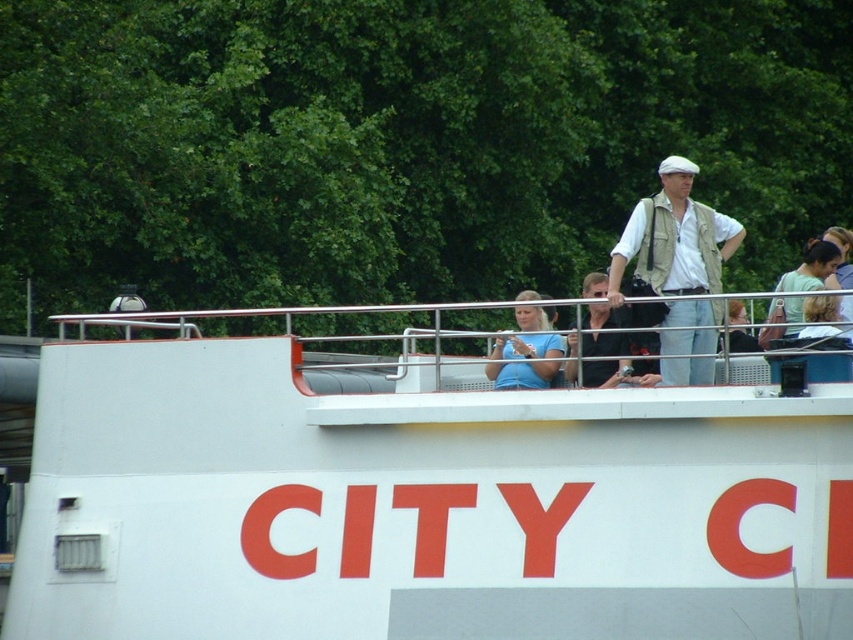
Question: Considering the real-world distances, which object is farthest from the matte blue shirt at center?

Choices:
 (A) light brown leather jacket at upper right
 (B) light beige vest at center
 (C) white matte boat at center

Answer: (C)

Question: Observing the image, what is the correct spatial positioning of white matte boat at center in reference to light brown leather jacket at upper right?

Choices:
 (A) below
 (B) above

Answer: (A)

Question: Estimate the real-world distances between objects in this image. Which object is closer to the light beige vest at center?

Choices:
 (A) light brown wooden chair at upper center
 (B) light brown leather jacket at upper right
 (C) matte blue shirt at center

Answer: (A)

Question: Which point is closer to the camera?

Choices:
 (A) light brown wooden chair at upper center
 (B) light brown leather jacket at upper right
 (C) matte blue shirt at center

Answer: (B)

Question: Is white matte boat at center positioned before matte blue shirt at center?

Choices:
 (A) no
 (B) yes

Answer: (B)

Question: Is matte blue shirt at center to the right of light brown wooden chair at upper center from the viewer's perspective?

Choices:
 (A) yes
 (B) no

Answer: (B)